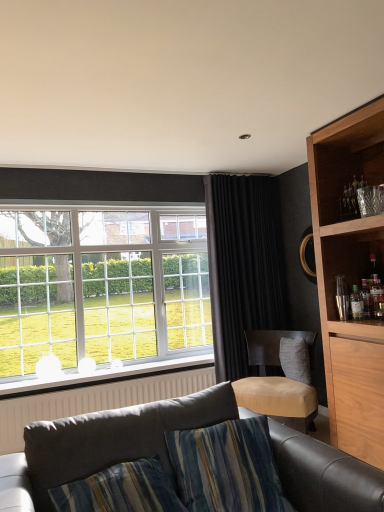
Locate an element on the screen. The width and height of the screenshot is (384, 512). leather cushioned chair at center is located at coordinates (277, 381).

Measure the distance between leather cushioned chair at center and camera.

leather cushioned chair at center is 9.04 feet from camera.

This screenshot has height=512, width=384. What do you see at coordinates (101, 286) in the screenshot?
I see `clear glass window at left` at bounding box center [101, 286].

I want to click on translucent glass bottle at right, which is the 1th bottle in left-to-right order, so click(356, 303).

Where is `dark gray fabric couch at lower center`? dark gray fabric couch at lower center is located at coordinates (108, 441).

Measure the distance between white textured radiator at lower left and camera.

white textured radiator at lower left is 9.97 feet away from camera.

I want to click on dark gray fabric armchair at right, so click(274, 347).

The height and width of the screenshot is (512, 384). Describe the element at coordinates (243, 266) in the screenshot. I see `black velvet curtain at center` at that location.

The height and width of the screenshot is (512, 384). Identify the location of leather cushioned chair at center. (277, 381).

From the image's perspective, would you say white textured radiator at lower left is shown under black velvet curtain at center?

Yes, from the image's perspective, white textured radiator at lower left is beneath black velvet curtain at center.

Does point (95, 387) appear closer or farther from the camera than point (217, 375)?

Clearly, point (95, 387) is closer to the camera than point (217, 375).

Can you confirm if white textured radiator at lower left is bigger than black velvet curtain at center?

Actually, white textured radiator at lower left might be smaller than black velvet curtain at center.

From the image's perspective, between white textured radiator at lower left and translucent glass bottles at right, which appears as the 2th bottle when viewed from the left, who is located below?

white textured radiator at lower left is shown below in the image.

From a real-world perspective, does white textured radiator at lower left stand above translucent glass bottles at right, the first bottle viewed from the right?

Actually, white textured radiator at lower left is physically below translucent glass bottles at right, the first bottle viewed from the right, in the real world.

Considering the relative sizes of white textured radiator at lower left and translucent glass bottles at right, which appears as the 2th bottle when viewed from the left, in the image provided, is white textured radiator at lower left taller than translucent glass bottles at right, which appears as the 2th bottle when viewed from the left,?

Yes, white textured radiator at lower left is taller than translucent glass bottles at right, which appears as the 2th bottle when viewed from the left.

Is black velvet curtain at center looking in the opposite direction of leather cushioned chair at center?

Absolutely, black velvet curtain at center is directed away from leather cushioned chair at center.

Is black velvet curtain at center wider or thinner than leather cushioned chair at center?

Considering their sizes, black velvet curtain at center looks slimmer than leather cushioned chair at center.

From a real-world perspective, which object stands above the other?

In real-world perspective, black velvet curtain at center is above.

Is dark gray fabric armchair at right completely or partially outside of translucent glass bottle at right, which is the 1th bottle in left-to-right order?

Yes, dark gray fabric armchair at right is not within translucent glass bottle at right, which is the 1th bottle in left-to-right order.

Can you confirm if dark gray fabric armchair at right is shorter than translucent glass bottle at right, which is the 1th bottle in left-to-right order?

In fact, dark gray fabric armchair at right may be taller than translucent glass bottle at right, which is the 1th bottle in left-to-right order.

From the image's perspective, is dark gray fabric armchair at right located beneath translucent glass bottle at right, which is the 1th bottle in left-to-right order?

Yes, from the image's perspective, dark gray fabric armchair at right is below translucent glass bottle at right, which is the 1th bottle in left-to-right order.

Does dark gray fabric armchair at right come behind translucent glass bottle at right, which is the 1th bottle in left-to-right order?

Yes, dark gray fabric armchair at right is further from the viewer.

Does dark gray fabric couch at lower center lie in front of leather cushioned chair at center?

Yes, it is.

Considering the positions of point (316, 459) and point (295, 407), is point (316, 459) closer or farther from the camera than point (295, 407)?

Point (316, 459) is closer to the camera than point (295, 407).

Would you consider dark gray fabric couch at lower center to be distant from leather cushioned chair at center?

dark gray fabric couch at lower center is positioned a significant distance from leather cushioned chair at center.

How distant is dark gray fabric armchair at right from leather cushioned chair at center?

dark gray fabric armchair at right and leather cushioned chair at center are 6.97 inches apart.

Considering the relative sizes of dark gray fabric armchair at right and leather cushioned chair at center in the image provided, is dark gray fabric armchair at right thinner than leather cushioned chair at center?

Yes.

Locate an element on the screen. The height and width of the screenshot is (512, 384). chair on the left of dark gray fabric armchair at right is located at coordinates [x=277, y=381].

Does dark gray fabric armchair at right have a greater height compared to leather cushioned chair at center?

No, dark gray fabric armchair at right is not taller than leather cushioned chair at center.

Considering the relative sizes of translucent glass bottles at right, the first bottle viewed from the right, and translucent glass bottle at right, the 2th bottle from the right, in the image provided, is translucent glass bottles at right, the first bottle viewed from the right, bigger than translucent glass bottle at right, the 2th bottle from the right,?

Indeed, translucent glass bottles at right, the first bottle viewed from the right, has a larger size compared to translucent glass bottle at right, the 2th bottle from the right.

Is translucent glass bottles at right, which appears as the 2th bottle when viewed from the left, oriented away from translucent glass bottle at right, which is the 1th bottle in left-to-right order?

No, translucent glass bottles at right, which appears as the 2th bottle when viewed from the left,'s orientation is not away from translucent glass bottle at right, which is the 1th bottle in left-to-right order.

From the image's perspective, is translucent glass bottles at right, which appears as the 2th bottle when viewed from the left, beneath translucent glass bottle at right, which is the 1th bottle in left-to-right order?

No.

This screenshot has height=512, width=384. I want to click on radiator that is on the left side of black velvet curtain at center, so click(94, 400).

This screenshot has height=512, width=384. I want to click on radiator behind the translucent glass bottles at right, which appears as the 2th bottle when viewed from the left, so click(x=94, y=400).

From the image, which object appears to be farther from translucent glass bottle at right, the 2th bottle from the right, dark gray fabric couch at lower center or black velvet curtain at center?

dark gray fabric couch at lower center lies further to translucent glass bottle at right, the 2th bottle from the right, than the other object.

In the scene shown: Looking at the image, which one is located closer to translucent glass bottles at right, the first bottle viewed from the right, dark gray fabric armchair at right or dark gray fabric couch at lower center?

Based on the image, dark gray fabric armchair at right appears to be nearer to translucent glass bottles at right, the first bottle viewed from the right.

From the picture: Considering their positions, is dark gray fabric couch at lower center positioned closer to black velvet curtain at center than leather cushioned chair at center?

leather cushioned chair at center.

Which object lies nearer to the anchor point translucent glass bottles at right, which appears as the 2th bottle when viewed from the left, leather cushioned chair at center or white textured radiator at lower left?

Based on the image, leather cushioned chair at center appears to be nearer to translucent glass bottles at right, which appears as the 2th bottle when viewed from the left.

Looking at the image, which one is located further to dark gray fabric couch at lower center, leather cushioned chair at center or translucent glass bottle at right, which is the 1th bottle in left-to-right order?

translucent glass bottle at right, which is the 1th bottle in left-to-right order, is positioned further to the anchor dark gray fabric couch at lower center.

When comparing their distances from translucent glass bottle at right, the 2th bottle from the right, does dark gray fabric couch at lower center or dark gray fabric armchair at right seem further?

dark gray fabric couch at lower center lies further to translucent glass bottle at right, the 2th bottle from the right, than the other object.

Which object lies further to the anchor point clear glass window at left, translucent glass bottle at right, the 2th bottle from the right, or leather cushioned chair at center?

translucent glass bottle at right, the 2th bottle from the right, is further to clear glass window at left.

Considering their positions, is translucent glass bottle at right, which is the 1th bottle in left-to-right order, positioned closer to dark gray fabric armchair at right than translucent glass bottles at right, which appears as the 2th bottle when viewed from the left?

Among the two, translucent glass bottle at right, which is the 1th bottle in left-to-right order, is located nearer to dark gray fabric armchair at right.

I want to click on armchair situated between clear glass window at left and translucent glass bottle at right, the 2th bottle from the right, from left to right, so click(x=274, y=347).

Locate an element on the screen. This screenshot has width=384, height=512. chair between white textured radiator at lower left and translucent glass bottles at right, which appears as the 2th bottle when viewed from the left, in the horizontal direction is located at coordinates (277, 381).

Locate an element on the screen. The width and height of the screenshot is (384, 512). chair located between white textured radiator at lower left and dark gray fabric armchair at right in the left-right direction is located at coordinates (277, 381).

Locate an element on the screen. This screenshot has width=384, height=512. curtain situated between white textured radiator at lower left and dark gray fabric armchair at right from left to right is located at coordinates (243, 266).